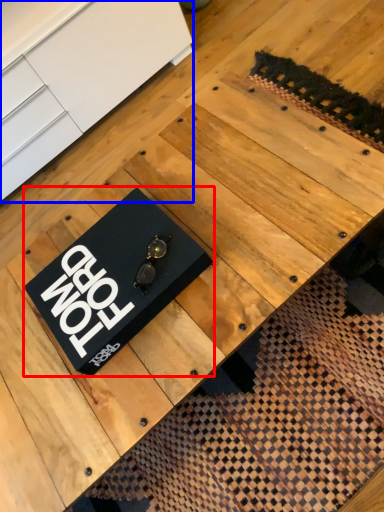
Question: Which point is further to the camera, plaque (highlighted by a red box) or furniture (highlighted by a blue box)?

Choices:
 (A) plaque
 (B) furniture

Answer: (B)